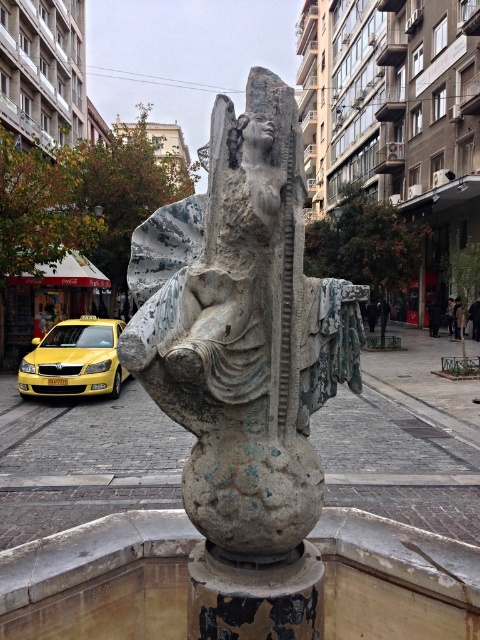
You are an art conservator assessing the public square. You see the green patina stone sculpture at center and the rusty metallic pillar at center. Which object is taller?

The green patina stone sculpture at center is much taller than the rusty metallic pillar at center.

From the picture: You are a maintenance worker inspecting the sculpture in the plaza. You notice a point at coordinate (254,595) on the sculpture. What object is located at that coordinate?

The point at coordinate (254,595) indicates a rusty metallic pillar at center.

You are standing in the public square and want to take a photo of the green patina stone sculpture at center. Where should you position yourself to capture it in the frame?

You should position yourself at point (242,330) to capture the green patina stone sculpture at center in the frame.